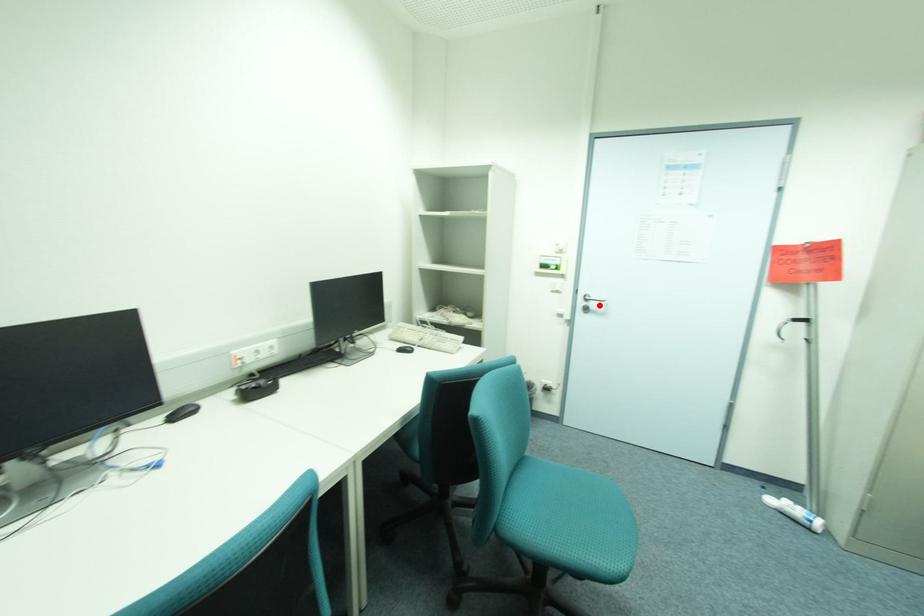
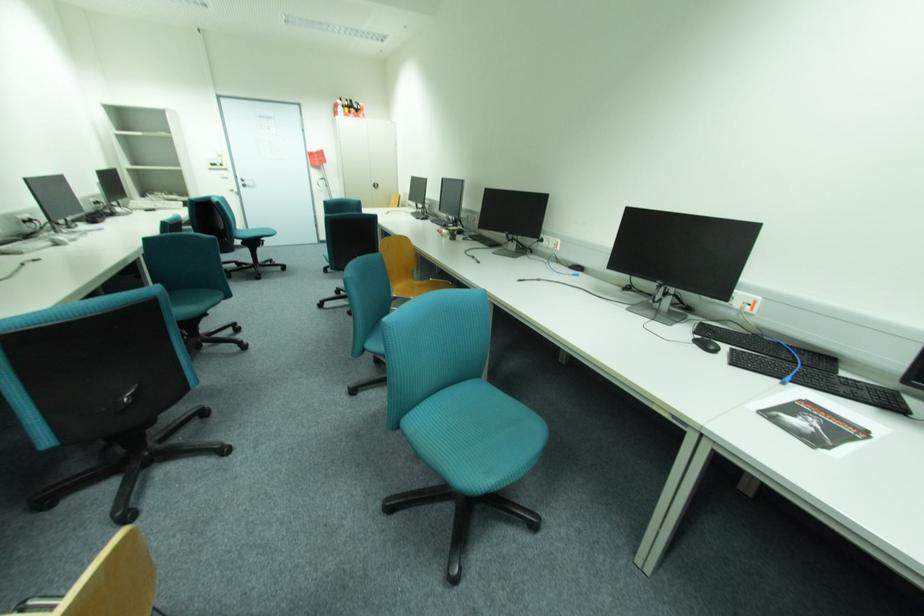
In the second image, find the point that corresponds to the highlighted location in the first image.

(253, 183)